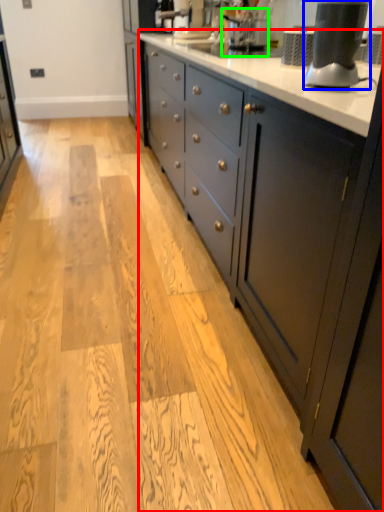
Question: Which is nearer to the countertop (highlighted by a red box)? home appliance (highlighted by a blue box) or coffee machine (highlighted by a green box).

Choices:
 (A) home appliance
 (B) coffee machine

Answer: (A)